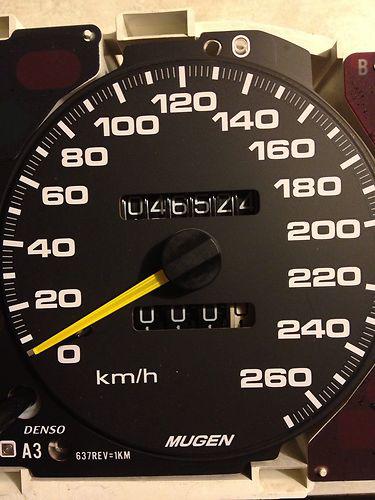
Find the location of `brownish red panels`. brownish red panels is located at coordinates (40, 87), (363, 89), (350, 460).